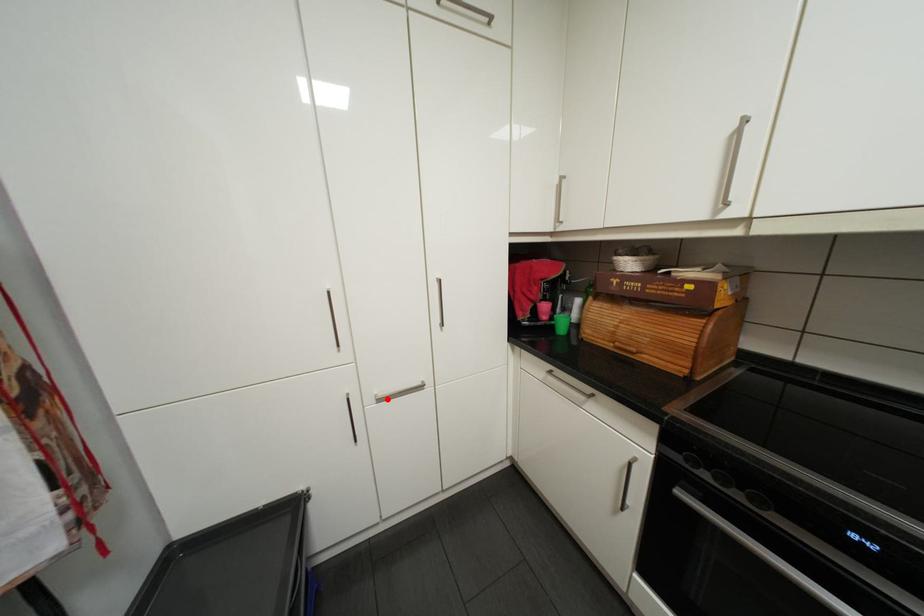
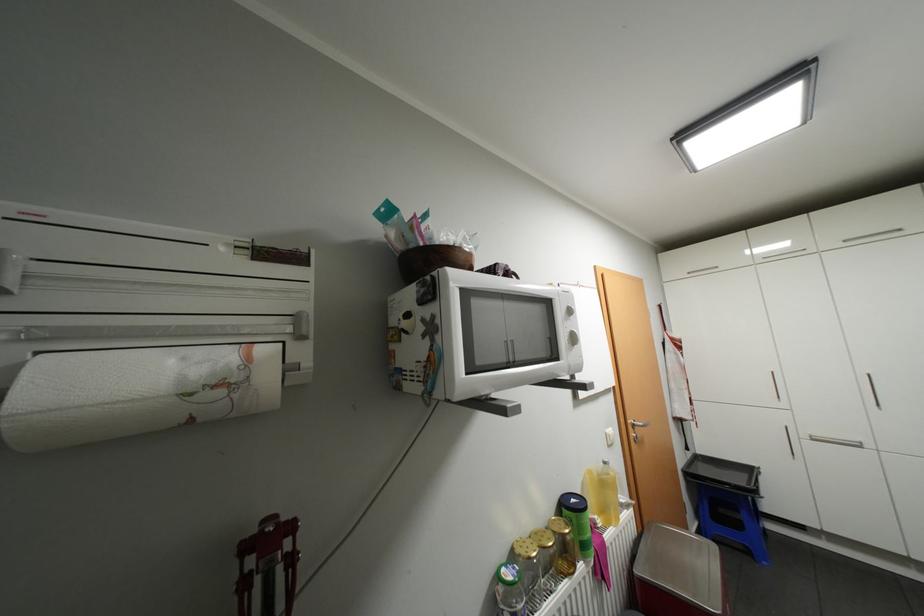
Find the pixel in the second image that matches the highlighted location in the first image.

(821, 438)